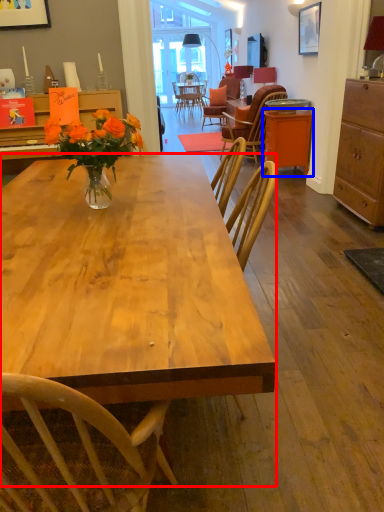
Question: Which object is closer to the camera taking this photo, desk (highlighted by a red box) or table (highlighted by a blue box)?

Choices:
 (A) desk
 (B) table

Answer: (A)